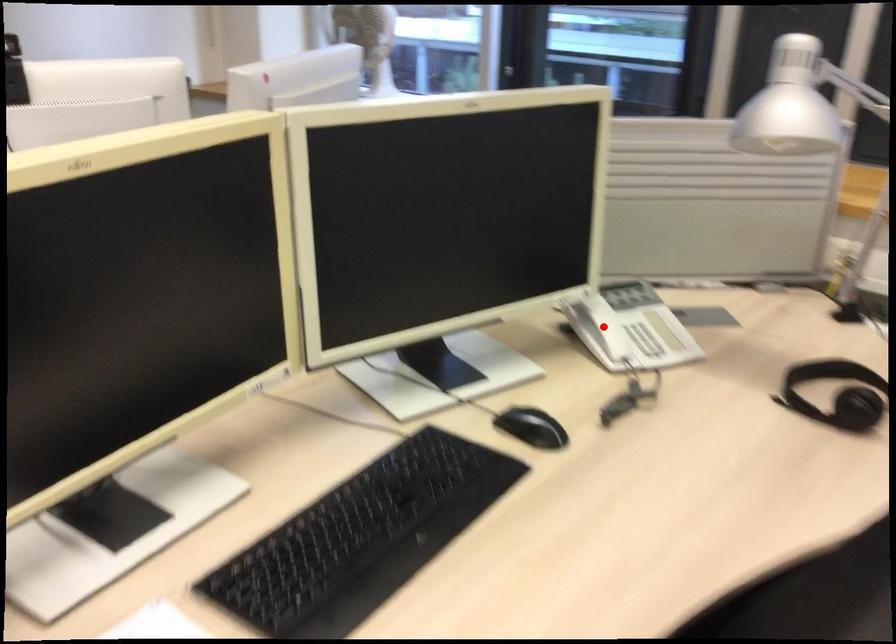
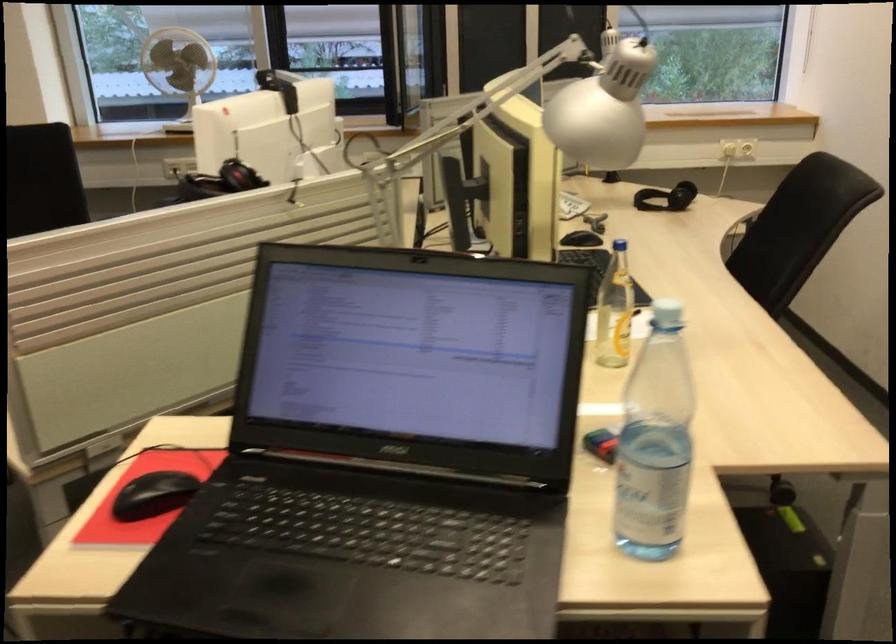
Question: I am providing you with two images of the same scene from different viewpoints. A red point is marked on the first image. Can you still see the location of the red point in image 2?

Choices:
 (A) Yes
 (B) No

Answer: (B)